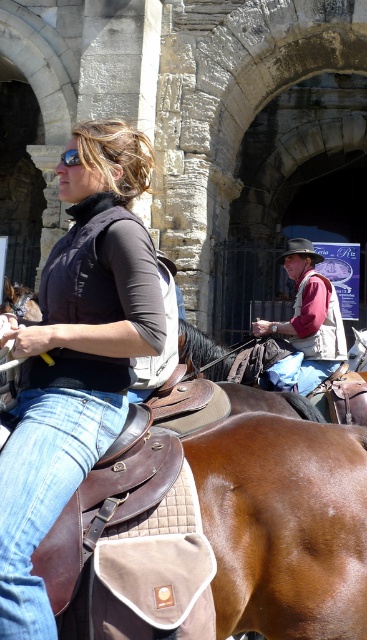
Does point (331, 332) come farther from viewer compared to point (285, 253)?

No, (331, 332) is in front of (285, 253).

Is rustic brown vest at center to the right of brown felt cowboy hat at center from the viewer's perspective?

Incorrect, rustic brown vest at center is not on the right side of brown felt cowboy hat at center.

I want to click on rustic brown vest at center, so click(x=307, y=323).

Who is positioned more to the left, matte black vest at upper left or black matte goggles at upper left?

black matte goggles at upper left

Does matte black vest at upper left have a greater width compared to black matte goggles at upper left?

In fact, matte black vest at upper left might be narrower than black matte goggles at upper left.

Is point (52, 336) positioned after point (67, 148)?

That is False.

Identify the location of matte black vest at upper left. This screenshot has height=640, width=367. (77, 356).

Is matte black vest at upper left closer to camera compared to rustic brown vest at center?

That is True.

Can you confirm if matte black vest at upper left is positioned below rustic brown vest at center?

Correct, matte black vest at upper left is located below rustic brown vest at center.

Which is behind, point (74, 196) or point (270, 380)?

Point (270, 380)

This screenshot has width=367, height=640. Find the location of `matte black vest at upper left`. matte black vest at upper left is located at coordinates (77, 356).